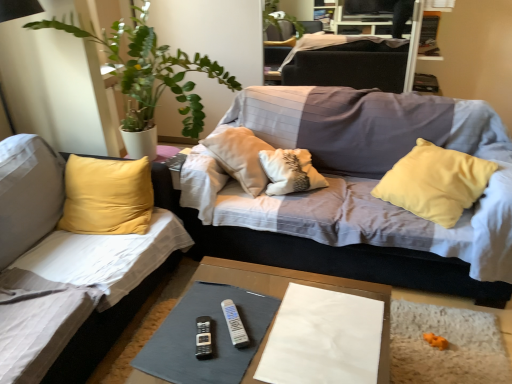
Locate an element on the screen. The height and width of the screenshot is (384, 512). vacant area to the right of black plastic remote at center, which is the second remote from right to left is located at coordinates (253, 336).